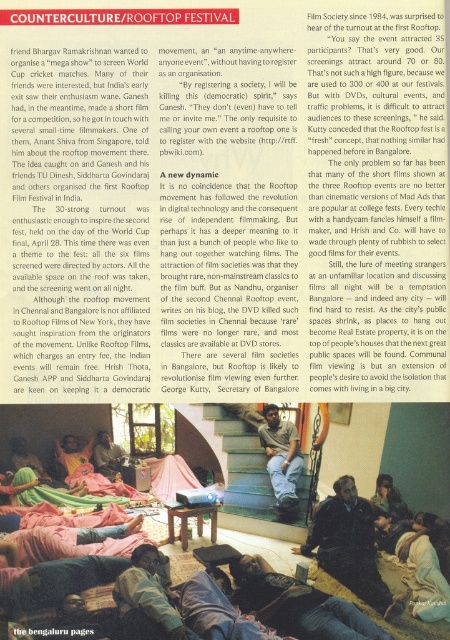
Who is more forward, (319,541) or (148,605)?

Point (148,605)

Does dark brown leather jacket at center come in front of dark blue jeans at center?

That is False.

You are a GUI agent. You are given a task and a screenshot of the screen. Output one action in this format:
    pyautogui.click(x=<x>, y=<y>)
    Task: Click on the dark brown leather jacket at center
    The image size is (450, 640).
    Given the screenshot: What is the action you would take?
    pyautogui.click(x=350, y=547)

Looking at this image, between dark brown leather jacket at center and matte black laptop at center, which one is positioned higher?

Positioned higher is dark brown leather jacket at center.

Locate an element on the screen. This screenshot has width=450, height=640. dark brown leather jacket at center is located at coordinates (350, 547).

Is dark blue jeans at center to the right of smooth wooden chair at center from the viewer's perspective?

Correct, you'll find dark blue jeans at center to the right of smooth wooden chair at center.

Between dark blue jeans at center and smooth wooden chair at center, which one is positioned lower?

smooth wooden chair at center

In order to click on dark blue jeans at center in this screenshot , I will do (x=148, y=598).